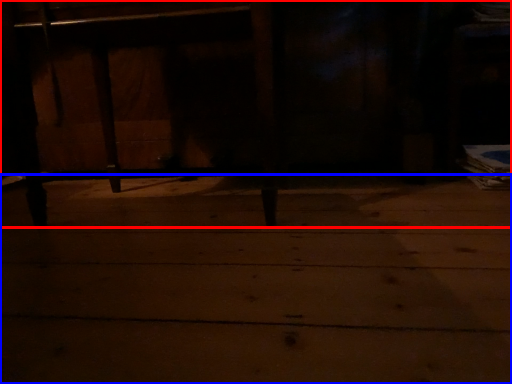
Question: Which object appears closest to the camera in this image, furniture (highlighted by a red box) or concrete (highlighted by a blue box)?

Choices:
 (A) furniture
 (B) concrete

Answer: (B)